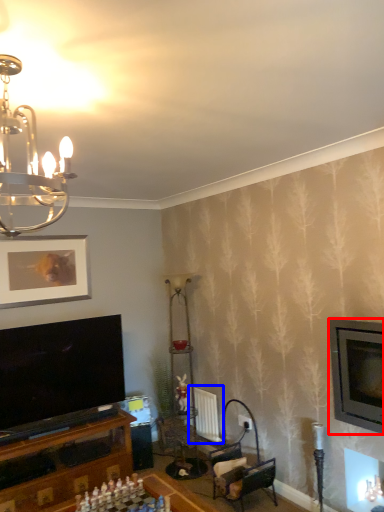
Question: Which object is further to the camera taking this photo, television (highlighted by a red box) or radiator (highlighted by a blue box)?

Choices:
 (A) television
 (B) radiator

Answer: (B)